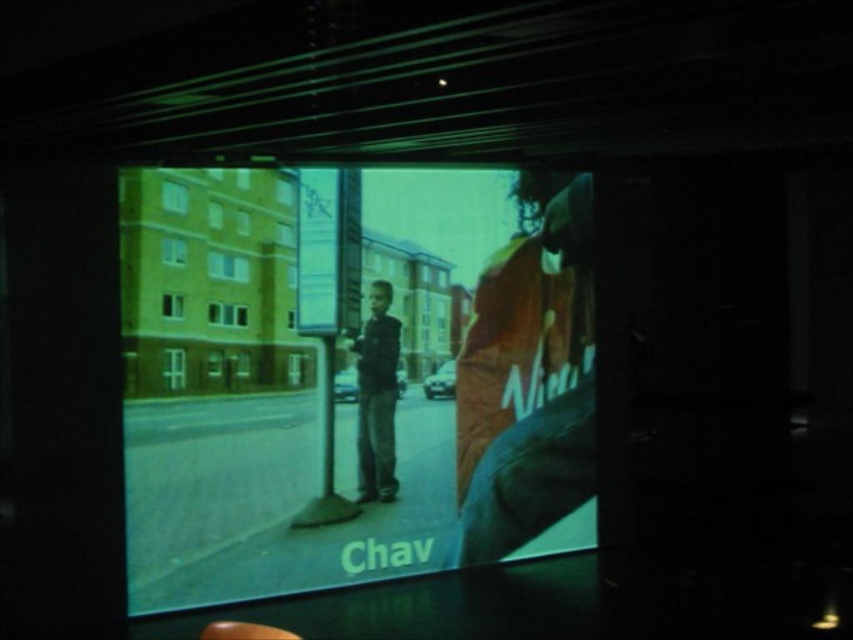
Question: From the image, what is the correct spatial relationship of matte plastic screen at center in relation to orange fabric shirt at right?

Choices:
 (A) left
 (B) right

Answer: (A)

Question: Can you confirm if matte plastic screen at center is smaller than dark blue jeans at center?

Choices:
 (A) yes
 (B) no

Answer: (B)

Question: Which object is closer to the camera taking this photo?

Choices:
 (A) orange fabric shirt at right
 (B) matte plastic screen at center
 (C) dark blue jeans at center

Answer: (B)

Question: Which of the following is the closest to the observer?

Choices:
 (A) orange fabric shirt at right
 (B) matte plastic screen at center

Answer: (B)

Question: Considering the real-world distances, which object is farthest from the dark blue jeans at center?

Choices:
 (A) orange fabric shirt at right
 (B) matte plastic screen at center

Answer: (A)

Question: Does matte plastic screen at center have a larger size compared to orange fabric shirt at right?

Choices:
 (A) no
 (B) yes

Answer: (B)